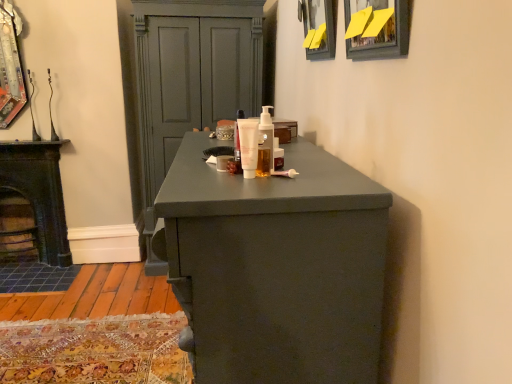
At what (x,y) coordinates should I click in order to perform the action: click on vacant space in front of white matte tube at center, marked as the 2th mouthwash in a back-to-front arrangement. Please return your answer as a coordinate pair (x, y). This screenshot has width=512, height=384. Looking at the image, I should click on (244, 184).